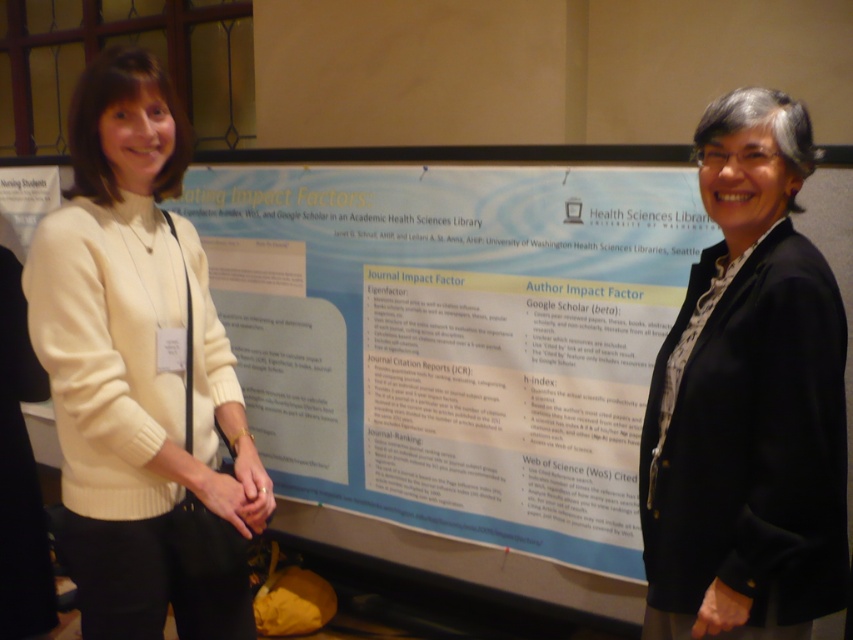
Is creamy wool sweater at left above black textured blazer at right?

Yes, creamy wool sweater at left is above black textured blazer at right.

Which is more to the right, creamy wool sweater at left or black textured blazer at right?

From the viewer's perspective, black textured blazer at right appears more on the right side.

This screenshot has width=853, height=640. I want to click on creamy wool sweater at left, so click(137, 365).